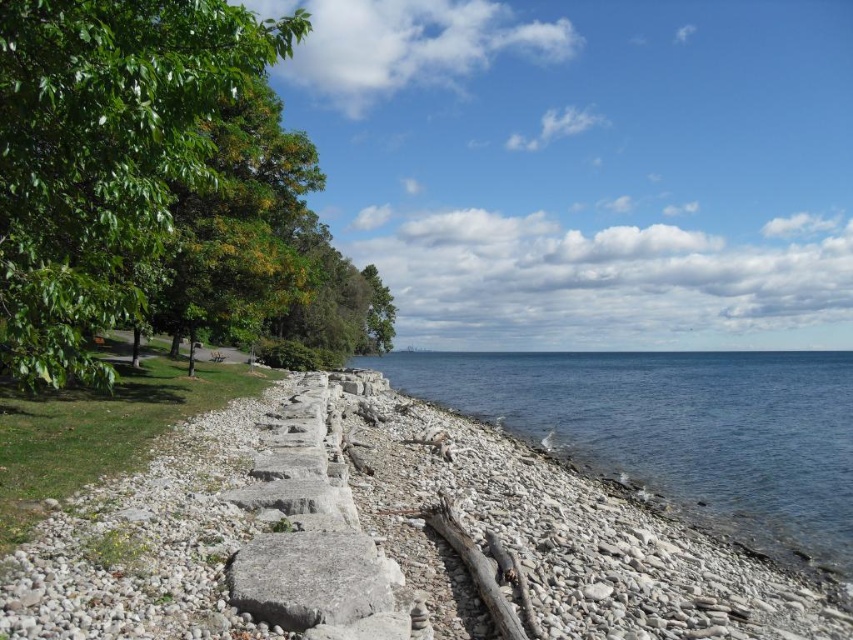
Does white gravel at lower center have a smaller size compared to green leafy tree at left?

Yes.

Is point (665, 552) less distant than point (109, 88)?

That is False.

Find the location of `white gravel at lower center`. white gravel at lower center is located at coordinates (374, 538).

Looking at this image, is green leafy tree at left bigger than blue water at center?

Incorrect, green leafy tree at left is not larger than blue water at center.

Does green leafy tree at left have a greater width compared to blue water at center?

No, green leafy tree at left is not wider than blue water at center.

Does point (160, 36) lie in front of point (636, 460)?

Yes.

Where is `green leafy tree at left`? green leafy tree at left is located at coordinates click(x=105, y=156).

Does white gravel at lower center appear on the left side of blue water at center?

Indeed, white gravel at lower center is positioned on the left side of blue water at center.

Between point (581, 490) and point (686, 477), which one is positioned behind?

The point (686, 477) is behind.

Locate an element on the screen. white gravel at lower center is located at coordinates (374, 538).